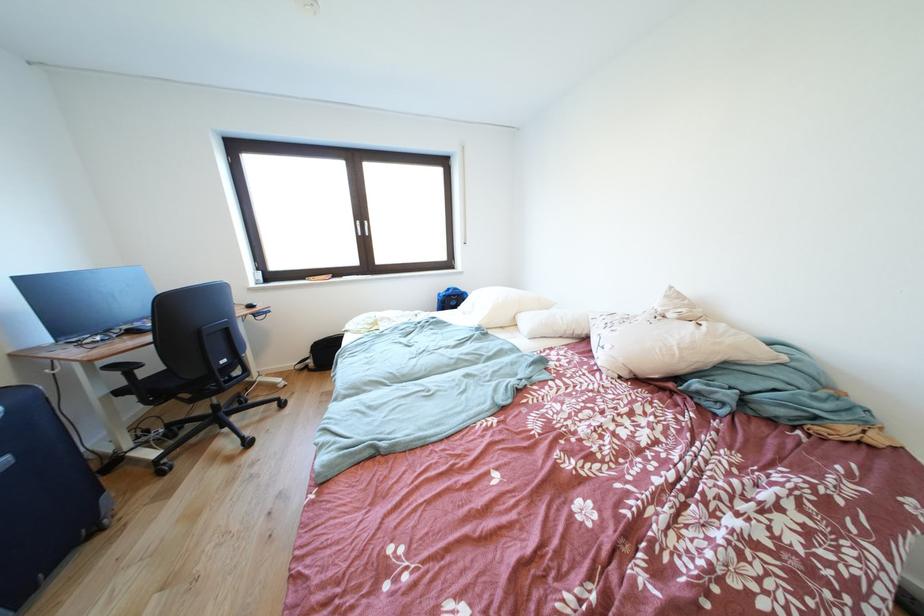
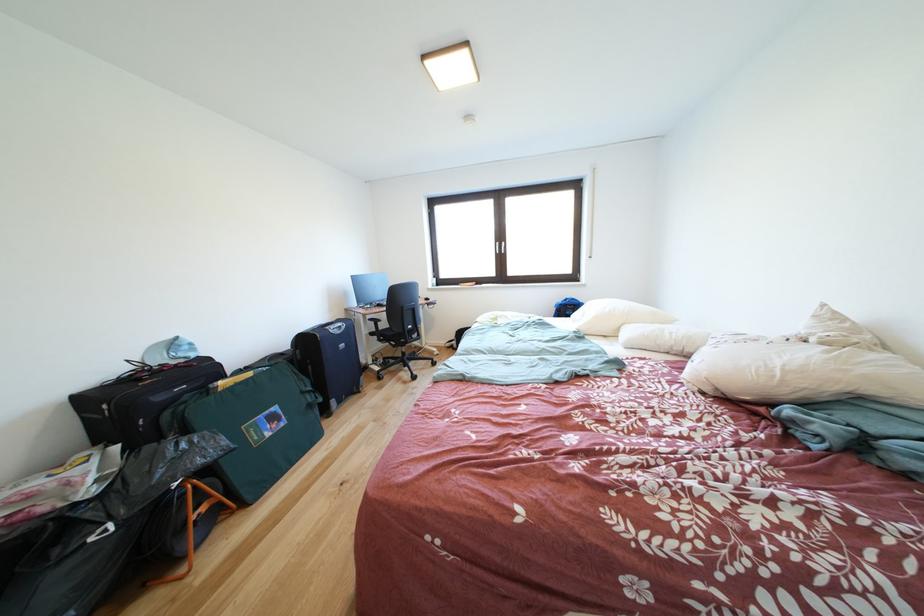
Locate, in the second image, the point that corresponds to the point at 199,406 in the first image.

(403, 351)